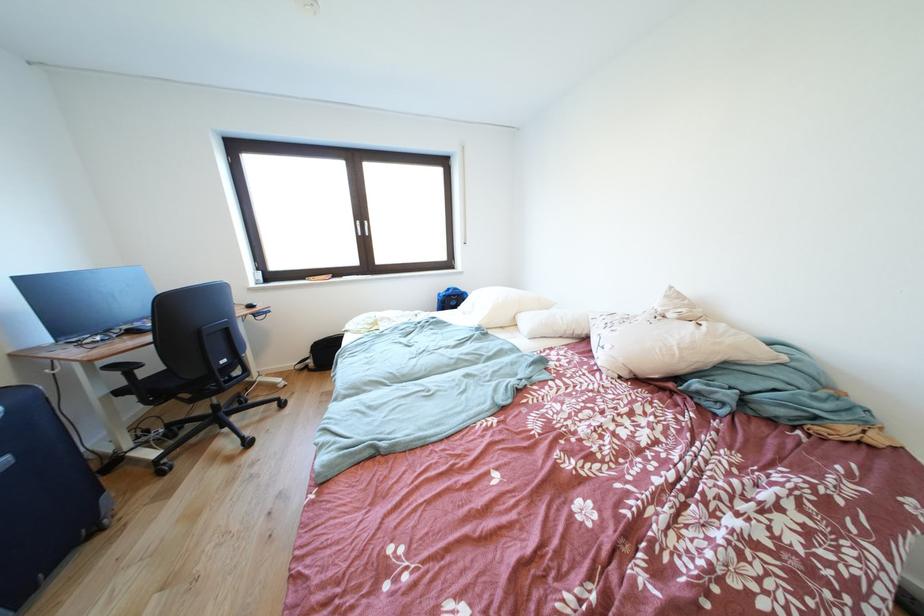
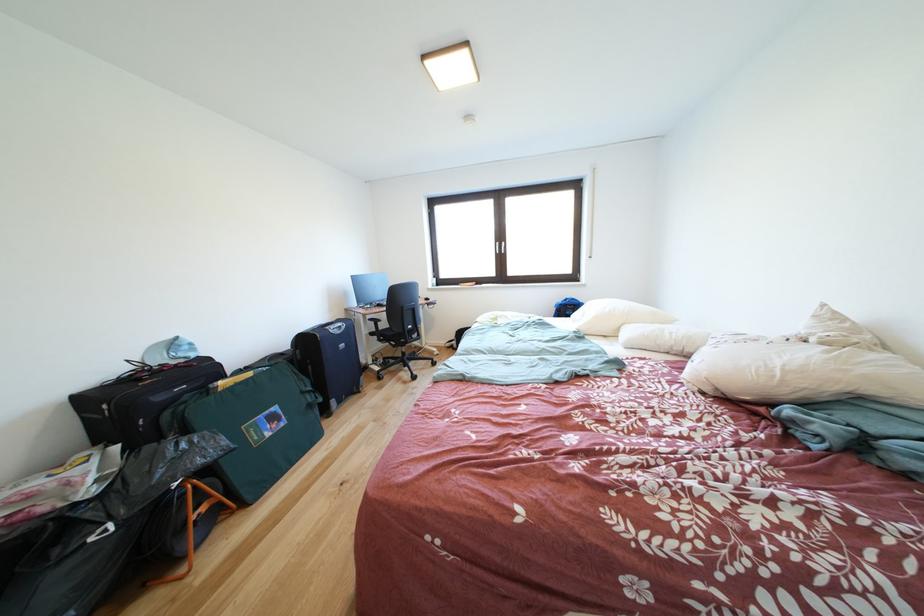
Locate, in the second image, the point that corresponds to the point at 199,406 in the first image.

(403, 351)